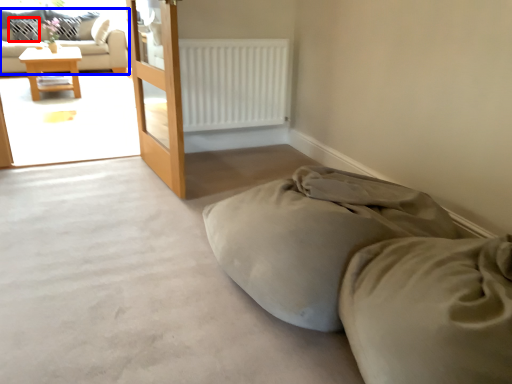
Question: Among these objects, which one is farthest to the camera, pillow (highlighted by a red box) or studio couch (highlighted by a blue box)?

Choices:
 (A) pillow
 (B) studio couch

Answer: (A)